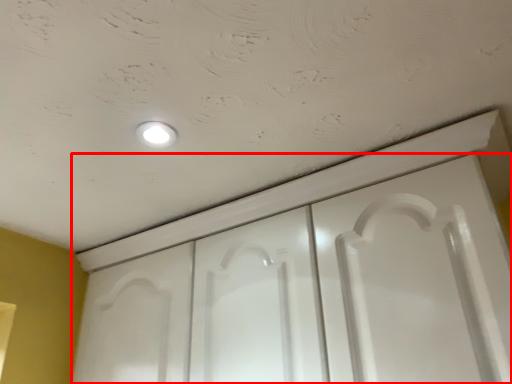
Question: From the image's perspective, where is door (annotated by the red box) located in relation to dot in the image?

Choices:
 (A) above
 (B) below

Answer: (B)